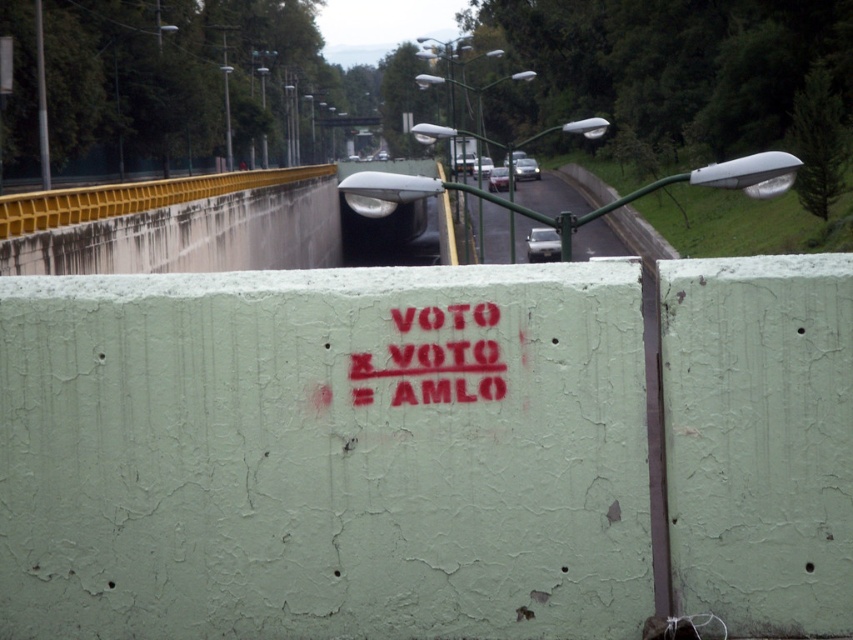
Can you confirm if red paint graffiti at center is positioned below gray asphalt road at center?

Correct, red paint graffiti at center is located below gray asphalt road at center.

Is red paint graffiti at center to the left of gray asphalt road at center from the viewer's perspective?

Correct, you'll find red paint graffiti at center to the left of gray asphalt road at center.

This screenshot has width=853, height=640. I want to click on red paint graffiti at center, so click(431, 371).

Can you confirm if green concrete wall at center is wider than gray asphalt road at center?

No, green concrete wall at center is not wider than gray asphalt road at center.

Can you confirm if green concrete wall at center is bigger than gray asphalt road at center?

Actually, green concrete wall at center might be smaller than gray asphalt road at center.

What are the coordinates of `green concrete wall at center` in the screenshot? It's located at (325, 452).

Where is `green concrete wall at center`? The width and height of the screenshot is (853, 640). green concrete wall at center is located at coordinates (325, 452).

Does green concrete wall at center come behind red paint graffiti at center?

No, green concrete wall at center is in front of red paint graffiti at center.

Consider the image. Can you confirm if green concrete wall at center is smaller than red paint graffiti at center?

No.

What do you see at coordinates (325, 452) in the screenshot? The image size is (853, 640). I see `green concrete wall at center` at bounding box center [325, 452].

Where is `green concrete wall at center`? The width and height of the screenshot is (853, 640). green concrete wall at center is located at coordinates click(x=325, y=452).